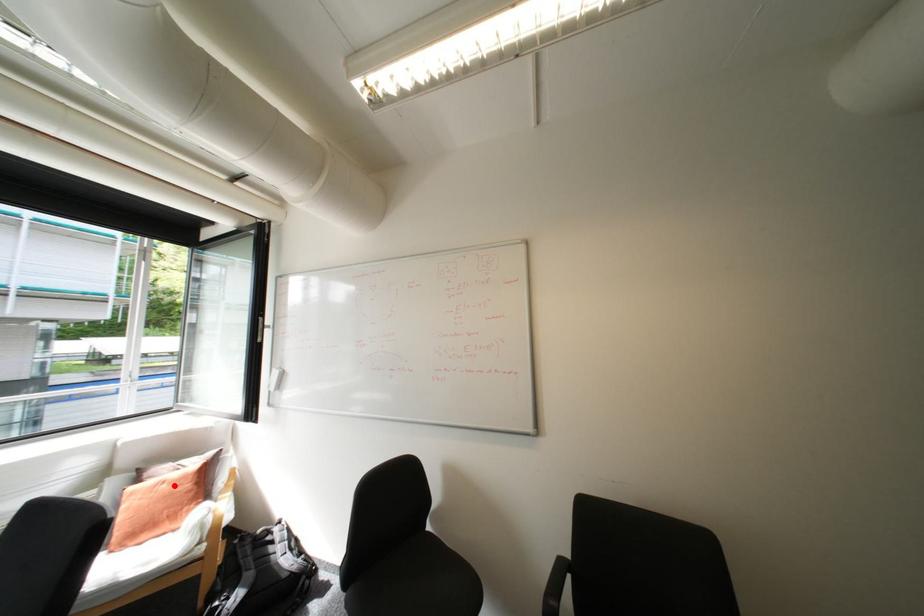
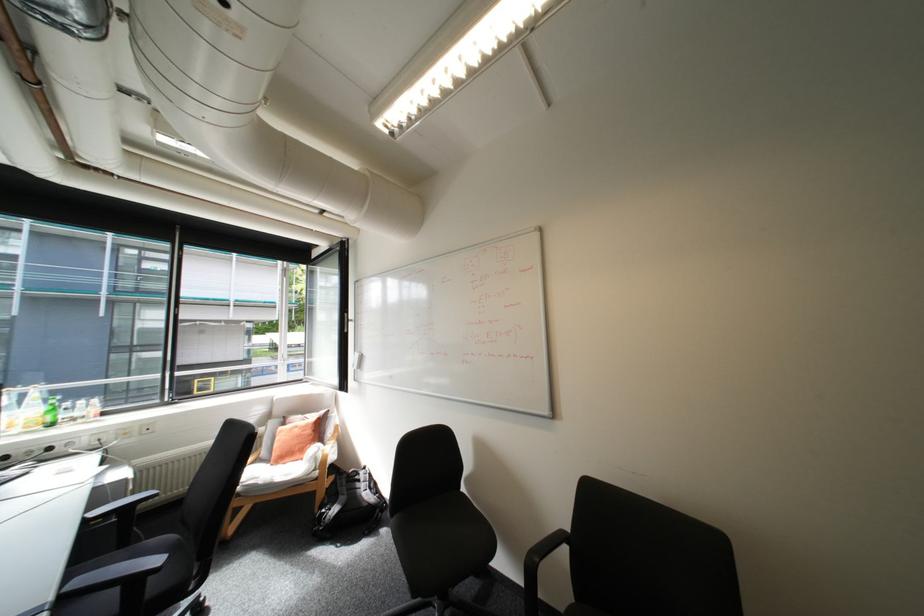
Question: I am providing you with two images of the same scene from different viewpoints. A red point is marked on the first image. Is the red point's position out of view in image 2?

Choices:
 (A) Yes
 (B) No

Answer: (B)